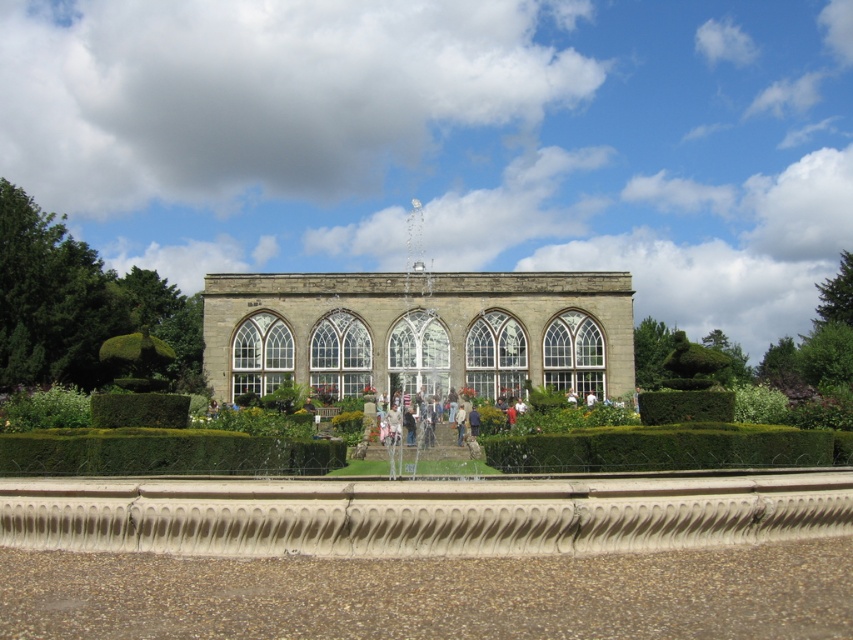
You are standing in the garden and want to take a photo of the stone glass palace at center and the green leafy hedge at lower center. Which object should you focus on first if you want to capture both in a single frame without moving the camera?

You should focus on the green leafy hedge at lower center first because the stone glass palace at center is located above it, so adjusting the camera to include the lower hedge will naturally include the palace above in the frame.

You are standing in the garden in front of the grand stone building. You see two points marked in the scene. Which point is closer to you, point (514,461) or point (152,408)?

Point (514,461) is further to the viewer than point (152,408), so point (152,408) is closer to you.

You are standing in the garden and want to take a photo of the green leafy hedge at center. If your camera has a maximum focus range of 90 meters, will you be able to capture it clearly?

The green leafy hedge at center is 93.44 meters away from the camera, which exceeds the maximum focus range of 90 meters. Therefore, the camera cannot capture it clearly.